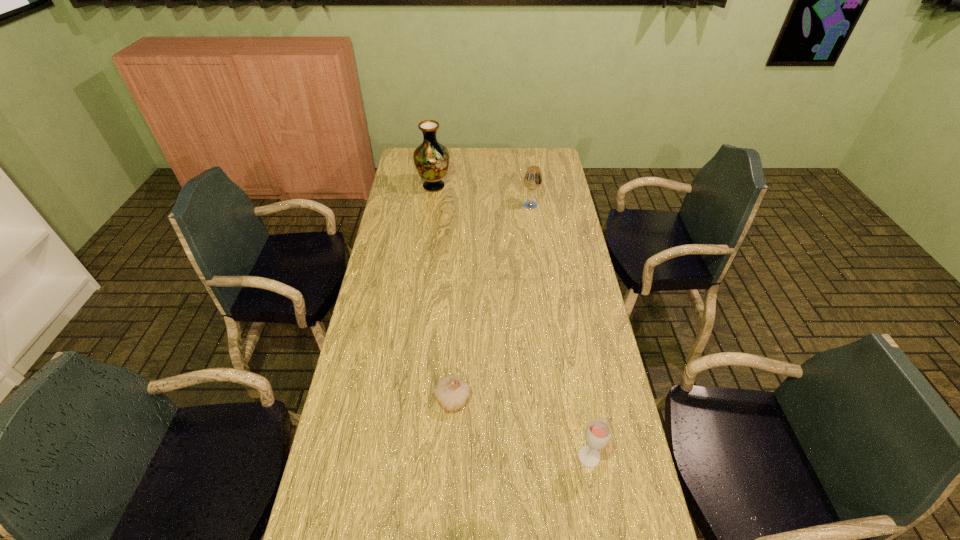
This screenshot has width=960, height=540. What are the coordinates of `the leftmost object` in the screenshot? It's located at (431, 159).

Find the location of a particular element. This screenshot has width=960, height=540. the farthest object is located at coordinates (431, 159).

Find the location of `the farther wineglass`. the farther wineglass is located at coordinates (532, 180).

Where is `the nearest object`? The height and width of the screenshot is (540, 960). the nearest object is located at coordinates (597, 434).

Find the location of a particular element. the nearer wineglass is located at coordinates (597, 434).

Find the location of a particular element. This screenshot has height=540, width=960. the third object from right to left is located at coordinates (451, 392).

Where is `garlic`? The height and width of the screenshot is (540, 960). garlic is located at coordinates (451, 392).

Identify the location of vacant area situated 0.050m on the front of the tallest object. This screenshot has width=960, height=540. tap(432, 202).

I want to click on vacant region located 0.260m on the left of the farther wineglass, so click(x=464, y=205).

I want to click on vacant space located on the left of the shorter wineglass, so click(537, 457).